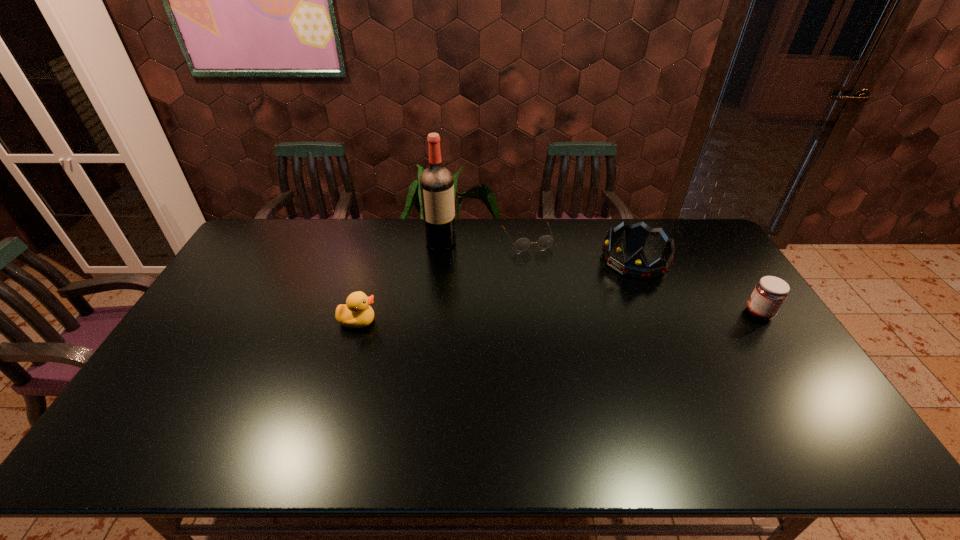
Find the location of a particular element. The width and height of the screenshot is (960, 540). the leftmost object is located at coordinates (357, 313).

Find the location of `the rightmost object`. the rightmost object is located at coordinates (770, 292).

You are a GUI agent. You are given a task and a screenshot of the screen. Output one action in this format:
    pyautogui.click(x=<x>, y=<y>)
    Task: Click on the fourth shortest object
    
    Given the screenshot: What is the action you would take?
    pyautogui.click(x=637, y=266)

The width and height of the screenshot is (960, 540). In order to click on tiara in this screenshot , I will do `click(637, 266)`.

Find the location of a particular element. The width and height of the screenshot is (960, 540). the shortest object is located at coordinates pyautogui.click(x=522, y=244).

Find the location of a particular element. The image size is (960, 540). the third object from left to right is located at coordinates (522, 244).

The height and width of the screenshot is (540, 960). I want to click on the second object from left to right, so click(x=436, y=182).

Locate an element on the screen. liquor is located at coordinates (436, 182).

Locate an element on the screen. The width and height of the screenshot is (960, 540). vacant space located on the face of the leftmost object is located at coordinates (424, 321).

At what (x,y) coordinates should I click in order to perform the action: click on free region located on the front of the jam. Please return your answer as a coordinate pair (x, y). The width and height of the screenshot is (960, 540). Looking at the image, I should click on (787, 355).